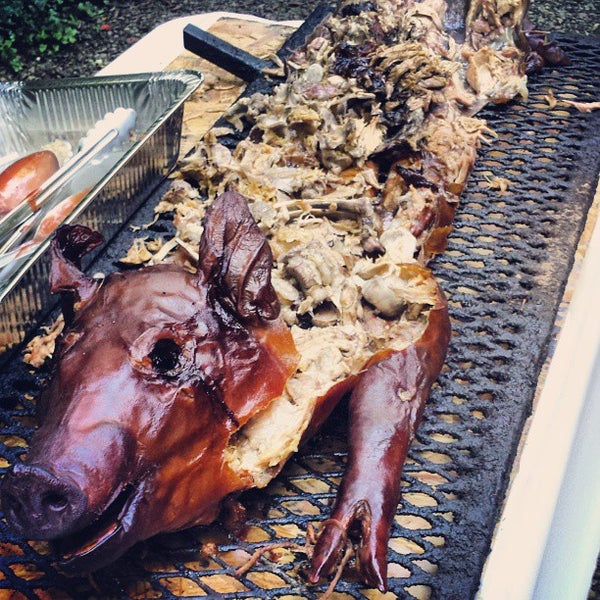
Where is `table`? table is located at coordinates (553, 465).